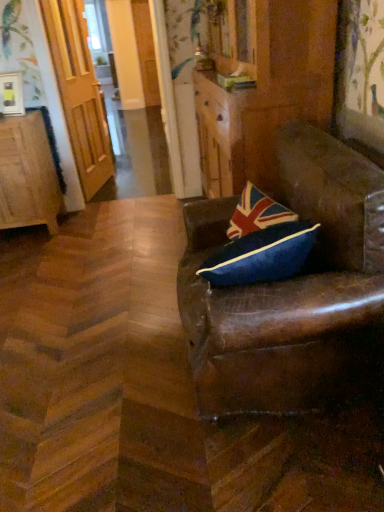
Question: In the image, is wooden cabinet at left on the left side or the right side of brown leather chair at right?

Choices:
 (A) right
 (B) left

Answer: (B)

Question: Is wooden cabinet at left inside or outside of brown leather chair at right?

Choices:
 (A) outside
 (B) inside

Answer: (A)

Question: Estimate the real-world distances between objects in this image. Which object is farther from the wooden cabinet at left?

Choices:
 (A) brown leather dresser at center
 (B) brown leather chair at right
 (C) wooden door at left

Answer: (B)

Question: Estimate the real-world distances between objects in this image. Which object is farther from the brown leather chair at right?

Choices:
 (A) wooden cabinet at left
 (B) wooden door at left
 (C) brown leather dresser at center

Answer: (B)